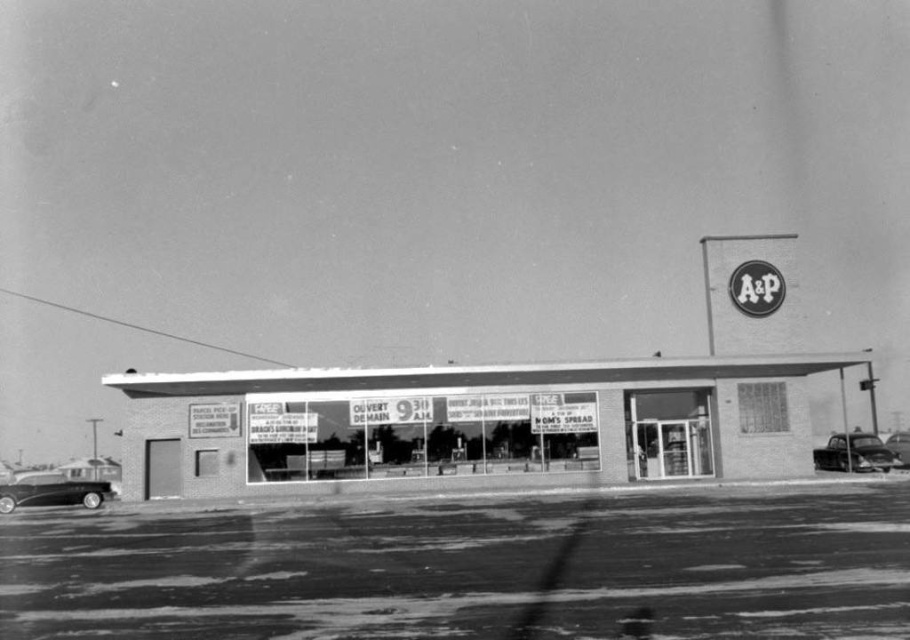
Question: Is brick facade store at center closer to the viewer compared to shiny black car at lower right?

Choices:
 (A) yes
 (B) no

Answer: (A)

Question: Is shiny black car at lower right further to the viewer compared to shiny black car at right?

Choices:
 (A) yes
 (B) no

Answer: (B)

Question: Which object appears closest to the camera in this image?

Choices:
 (A) shiny black car at right
 (B) shiny black car at lower left

Answer: (B)

Question: Which object is closer to the camera taking this photo?

Choices:
 (A) shiny black car at right
 (B) shiny black car at lower left

Answer: (B)

Question: Which point appears farthest from the camera in this image?

Choices:
 (A) (31, 474)
 (B) (373, 396)
 (C) (901, 433)
 (D) (863, 442)

Answer: (A)

Question: Is shiny black car at lower left further to camera compared to shiny black car at lower right?

Choices:
 (A) yes
 (B) no

Answer: (B)